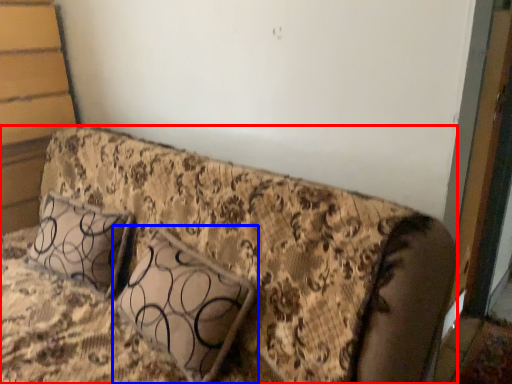
Question: Which object appears closest to the camera in this image, furniture (highlighted by a red box) or pillow (highlighted by a blue box)?

Choices:
 (A) furniture
 (B) pillow

Answer: (A)